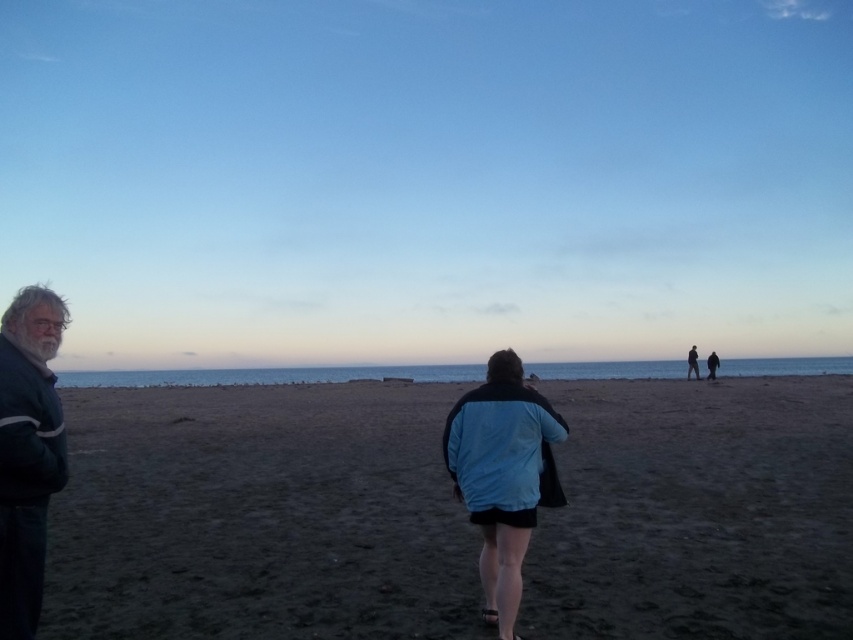
Does dark sand at center have a lesser height compared to blue fabric jacket at center?

In fact, dark sand at center may be taller than blue fabric jacket at center.

Who is more distant from viewer, (764, 445) or (474, 483)?

Positioned behind is point (764, 445).

The image size is (853, 640). Identify the location of dark sand at center. (259, 516).

Does blue fabric jacket at center have a larger size compared to dark blue jacket at center-right?

No, blue fabric jacket at center is not bigger than dark blue jacket at center-right.

Is blue fabric jacket at center further to camera compared to dark blue jacket at center-right?

No, blue fabric jacket at center is in front of dark blue jacket at center-right.

Measure the distance between blue fabric jacket at center and camera.

4.67 meters

What are the coordinates of `blue fabric jacket at center` in the screenshot? It's located at (500, 476).

From the picture: Can you confirm if dark sand at center is positioned below dark blue jacket at center-right?

Yes.

Which is below, dark sand at center or dark blue jacket at center-right?

dark sand at center is lower down.

Between point (178, 512) and point (695, 353), which one is positioned in front?

Point (178, 512)

Where is `dark sand at center`? dark sand at center is located at coordinates (259, 516).